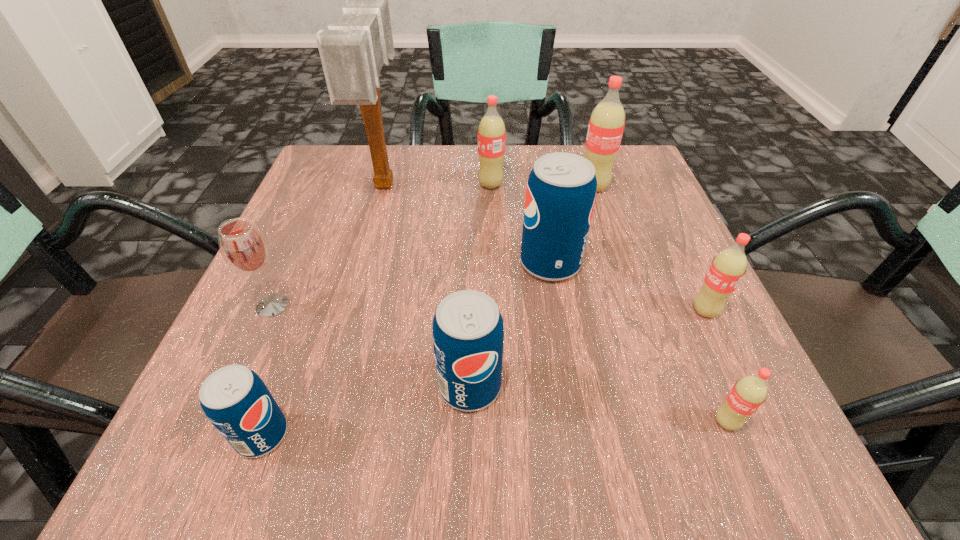
Identify the location of the third farthest red soda. (728, 267).

The image size is (960, 540). I want to click on the leftmost soda, so click(x=235, y=400).

Locate an element on the screen. This screenshot has width=960, height=540. the leftmost blue pop is located at coordinates (235, 400).

Where is `the smallest red soda`? the smallest red soda is located at coordinates (750, 392).

Image resolution: width=960 pixels, height=540 pixels. In order to click on the nearest red soda in this screenshot , I will do [750, 392].

The image size is (960, 540). What are the coordinates of `vacant space positioned 0.050m on the right of the tallest object` in the screenshot? It's located at (424, 184).

At what (x,y) coordinates should I click in order to perform the action: click on free space located 0.290m on the front of the fifth soda from left to right. Please return your answer as a coordinate pair (x, y). The width and height of the screenshot is (960, 540). Looking at the image, I should click on (629, 296).

Identify the location of vacant point located 0.050m on the right of the fifth nearest soda. The image size is (960, 540). (609, 263).

Image resolution: width=960 pixels, height=540 pixels. Identify the location of free region located 0.100m on the right of the second biggest red soda. (549, 185).

The width and height of the screenshot is (960, 540). I want to click on free space located on the front of the wineglass, so click(x=252, y=352).